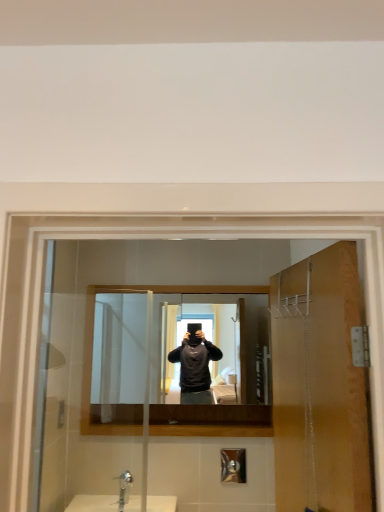
Question: Does matte black mirror at center have a smaller size compared to brushed metal shower at lower center?

Choices:
 (A) no
 (B) yes

Answer: (A)

Question: Is matte black mirror at center in contact with brushed metal shower at lower center?

Choices:
 (A) yes
 (B) no

Answer: (B)

Question: Considering the relative sizes of matte black mirror at center and brushed metal shower at lower center in the image provided, is matte black mirror at center bigger than brushed metal shower at lower center?

Choices:
 (A) yes
 (B) no

Answer: (A)

Question: From the image's perspective, is matte black mirror at center located above brushed metal shower at lower center?

Choices:
 (A) yes
 (B) no

Answer: (A)

Question: Does matte black mirror at center have a greater height compared to brushed metal shower at lower center?

Choices:
 (A) no
 (B) yes

Answer: (B)

Question: Is matte black mirror at center wider or thinner than brushed metal shower at lower center?

Choices:
 (A) thin
 (B) wide

Answer: (B)

Question: Is matte black mirror at center bigger or smaller than brushed metal shower at lower center?

Choices:
 (A) big
 (B) small

Answer: (A)

Question: From the image's perspective, is matte black mirror at center above or below brushed metal shower at lower center?

Choices:
 (A) above
 (B) below

Answer: (A)

Question: From a real-world perspective, relative to brushed metal shower at lower center, is matte black mirror at center vertically above or below?

Choices:
 (A) below
 (B) above

Answer: (B)

Question: Is point (129, 484) positioned closer to the camera than point (94, 320)?

Choices:
 (A) closer
 (B) farther

Answer: (B)

Question: Choose the correct answer: Is silver metallic faucet at lower center inside matte black mirror at center or outside it?

Choices:
 (A) outside
 (B) inside

Answer: (A)

Question: Is silver metallic faucet at lower center wider or thinner than matte black mirror at center?

Choices:
 (A) thin
 (B) wide

Answer: (B)

Question: From their relative heights in the image, would you say silver metallic faucet at lower center is taller or shorter than matte black mirror at center?

Choices:
 (A) short
 (B) tall

Answer: (A)

Question: In terms of width, does wooden door at right look wider or thinner when compared to brushed metal shower at lower center?

Choices:
 (A) wide
 (B) thin

Answer: (A)

Question: From a real-world perspective, is wooden door at right positioned above or below brushed metal shower at lower center?

Choices:
 (A) above
 (B) below

Answer: (A)